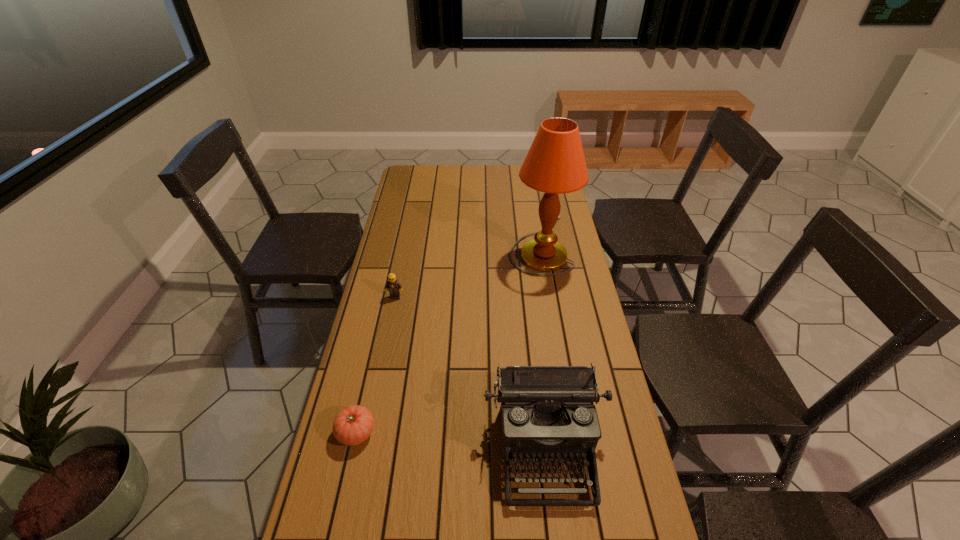
Find the location of a particular element. This screenshot has width=960, height=540. vacant point located between the shortest object and the third shortest object is located at coordinates (450, 440).

The image size is (960, 540). Find the location of `empty location between the tallest object and the third nearest object`. empty location between the tallest object and the third nearest object is located at coordinates (468, 271).

Find the location of `blank region between the typewriter and the farthest object`. blank region between the typewriter and the farthest object is located at coordinates (542, 346).

At what (x,y) coordinates should I click in order to perform the action: click on vacant space that is in between the lamp and the shortest object. Please return your answer as a coordinate pair (x, y). Looking at the image, I should click on (448, 339).

The height and width of the screenshot is (540, 960). Find the location of `vacant space that's between the second farthest object and the farthest object`. vacant space that's between the second farthest object and the farthest object is located at coordinates (468, 271).

This screenshot has width=960, height=540. What are the coordinates of `free area in between the second shortest object and the lamp` in the screenshot? It's located at (468, 271).

At what (x,y) coordinates should I click in order to perform the action: click on empty location between the tallest object and the Lego. Please return your answer as a coordinate pair (x, y). Looking at the image, I should click on (468, 271).

Select which object appears as the third closest to the tallest object. Please provide its 2D coordinates. Your answer should be formatted as a tuple, i.e. [(x, y)], where the tuple contains the x and y coordinates of a point satisfying the conditions above.

[(354, 424)]

The width and height of the screenshot is (960, 540). I want to click on object that can be found as the closest to the farthest object, so click(x=393, y=286).